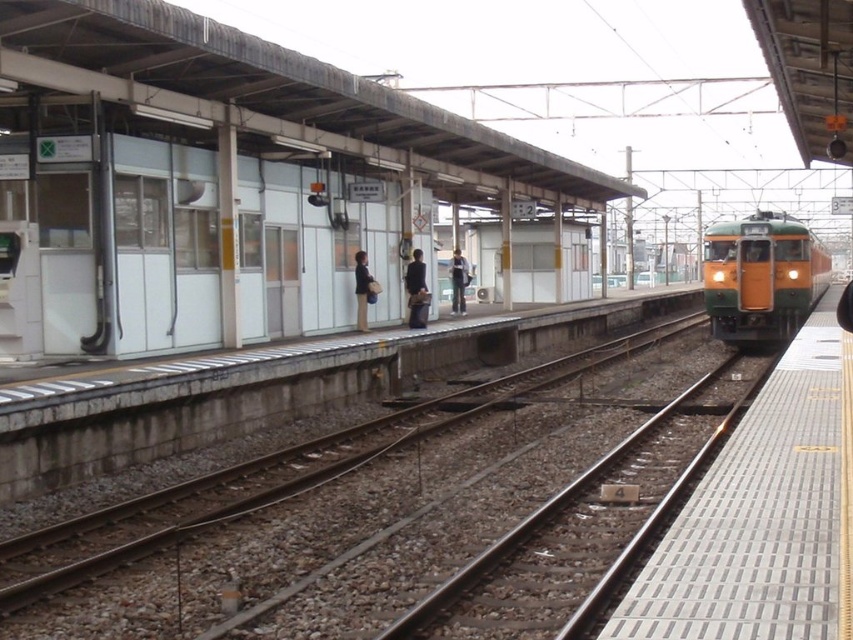
You are a tailor observing two jackets on a platform at a railway station. The jackets are both at the center of the platform. The dark blue fabric jacket at center and the dark gray fabric jacket at center. Which jacket is narrower in width?

The dark blue fabric jacket at center is narrower in width than the dark gray fabric jacket at center according to the description.